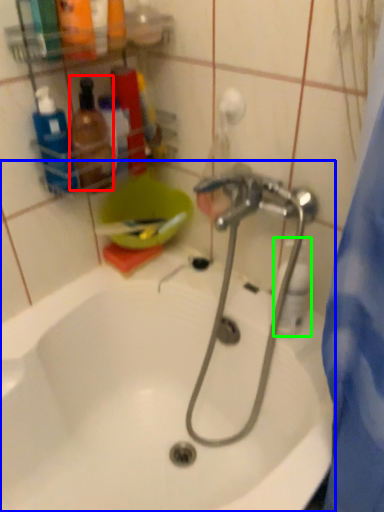
Question: Which object is the farthest from toiletry (highlighted by a red box)? Choose among these: bathtub (highlighted by a blue box) or cleaning product (highlighted by a green box).

Choices:
 (A) bathtub
 (B) cleaning product

Answer: (A)